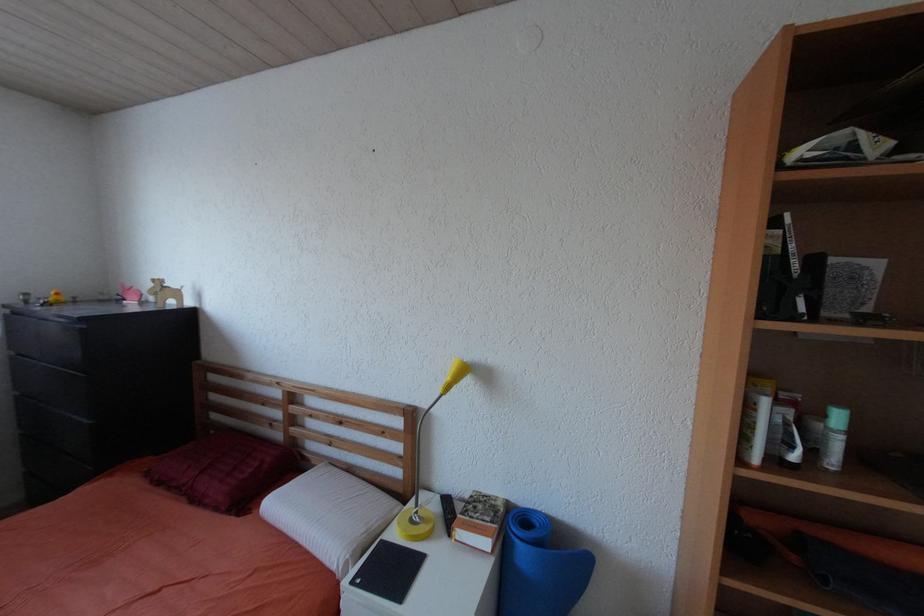
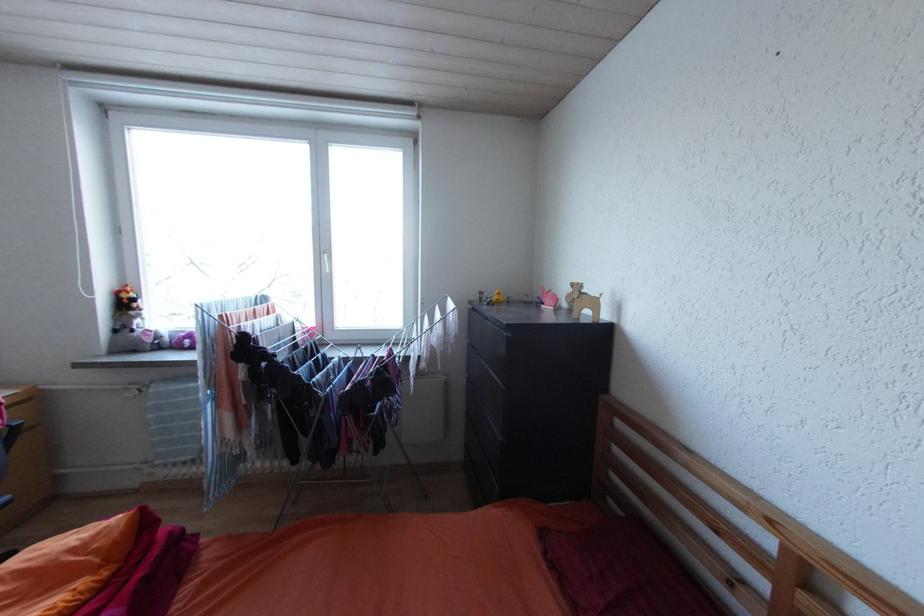
Question: Based on the continuous images, in which direction is the camera rotating? Reply with the corresponding letter.

Choices:
 (A) Left
 (B) Right
 (C) Up
 (D) Down

Answer: (A)